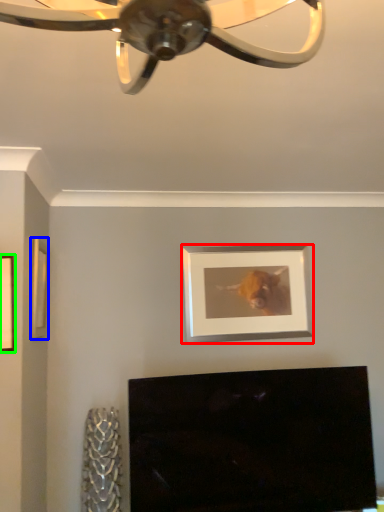
Question: Which object is the closest to the picture frame (highlighted by a red box)? Choose among these: picture frame (highlighted by a blue box) or picture frame (highlighted by a green box).

Choices:
 (A) picture frame
 (B) picture frame

Answer: (A)